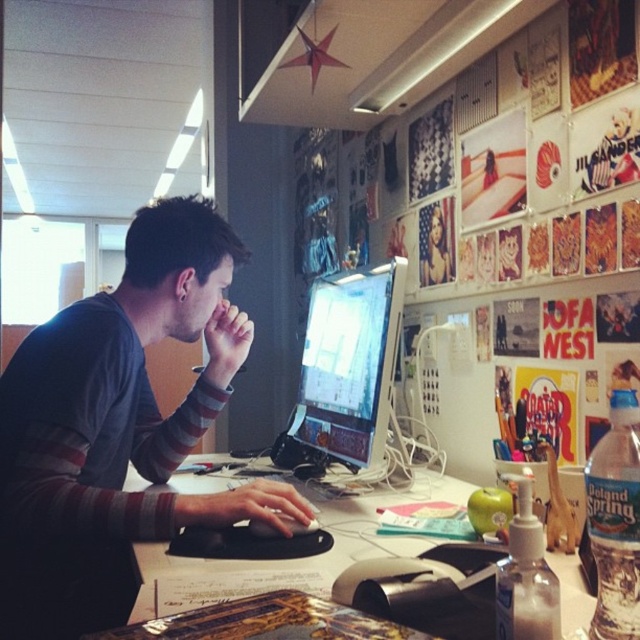
You are a photographer trying to capture the gray striped shirt at center and the white plastic computer desk at center. Which object is closer to the camera lens?

The gray striped shirt at center is positioned over the white plastic computer desk at center, so the gray striped shirt at center is closer to the camera lens.

Where is the gray striped shirt at center located in the image?

The gray striped shirt at center is located at the 2D coordinates point (x=116, y=428).

You are a photographer taking a portrait of the person at the desk. You want to ensure the gray striped shirt at center and the satin black monitor at center are both clearly visible in the photo. Which object should you focus on first to make sure both are in focus?

The gray striped shirt at center is located below the satin black monitor at center. To ensure both are in focus, you should focus on the satin black monitor at center first since it is farther away, allowing the gray striped shirt at center to also be in focus if the depth of field is sufficient.